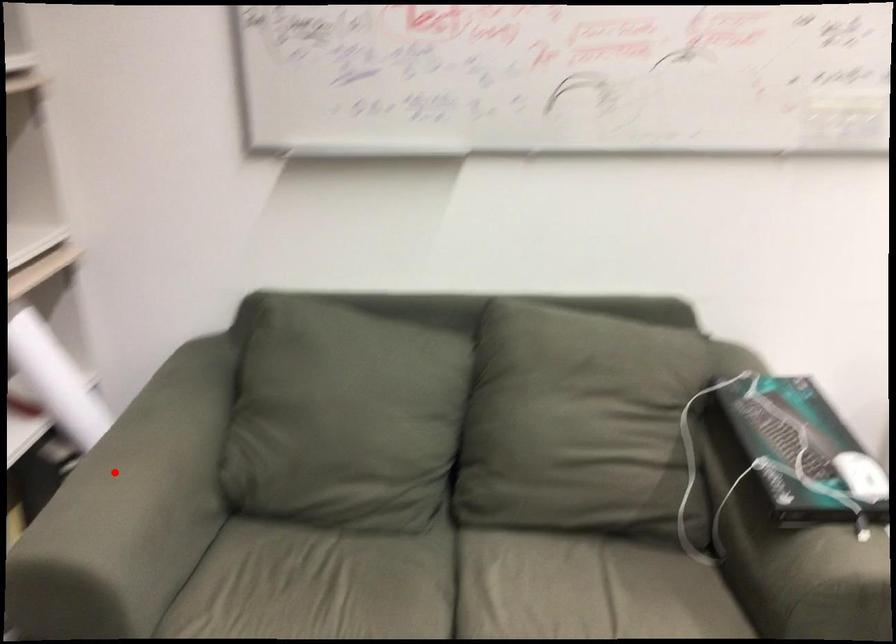
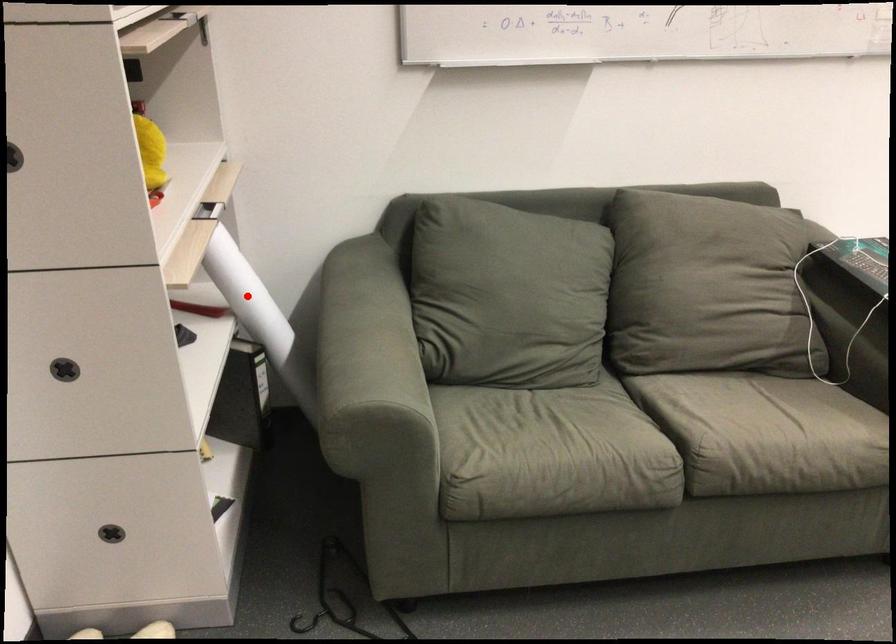
I am providing you with two images of the same scene from different viewpoints. A red point is marked on the first image and another point is marked on the second image. Do the highlighted points in image1 and image2 indicate the same real-world spot?

No